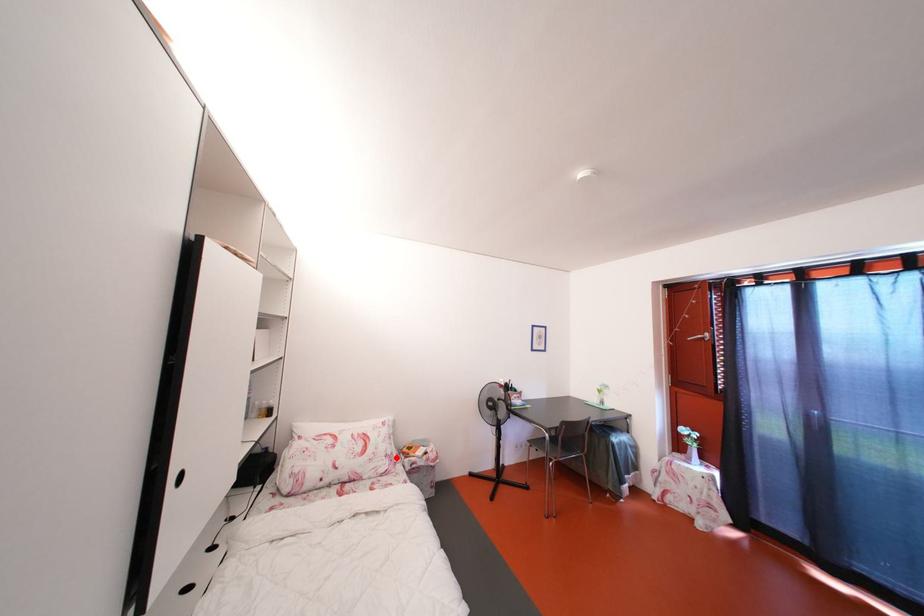
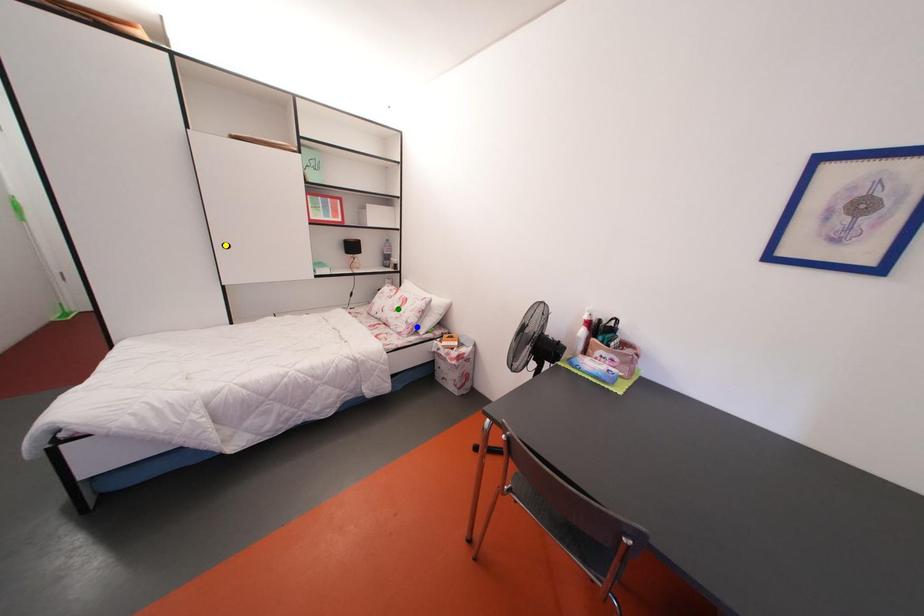
Question: I am providing you with two images of the same scene from different viewpoints. A red point is marked on the first image. You are given multiple points on the second image. In image 2, which mark is for the same physical point as the one in image 1?

Choices:
 (A) yellow point
 (B) blue point
 (C) green point

Answer: (B)